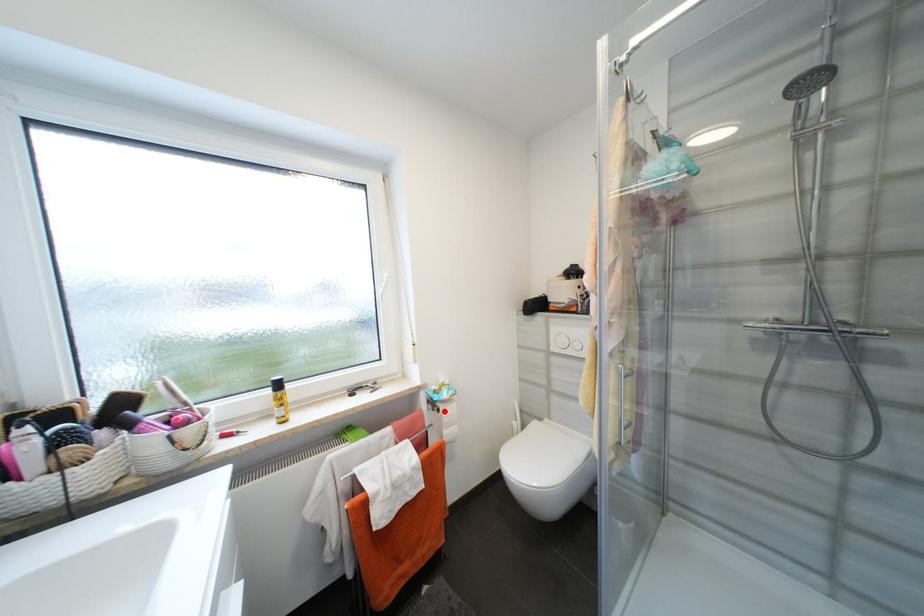
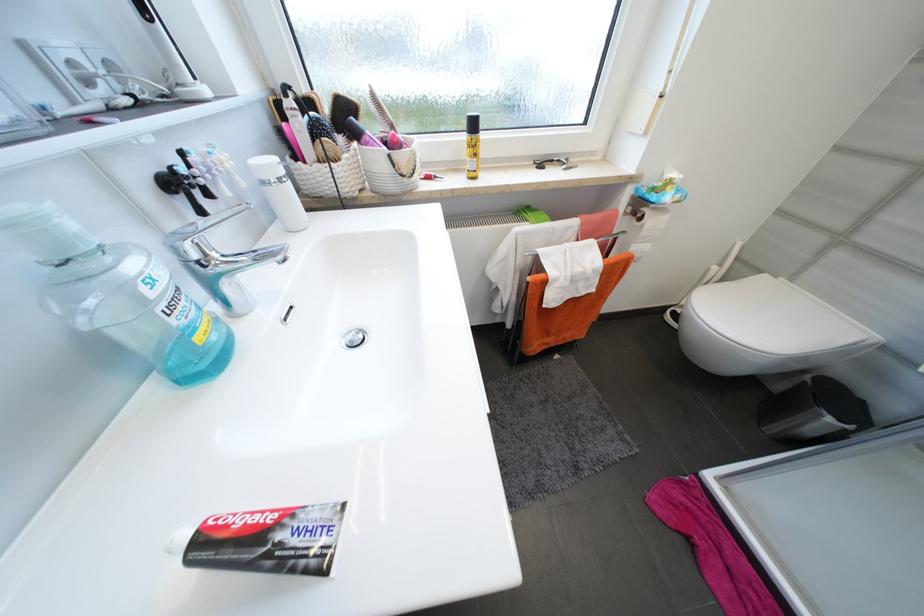
Locate, in the second image, the point that corresponds to the highlighted location in the first image.

(647, 219)